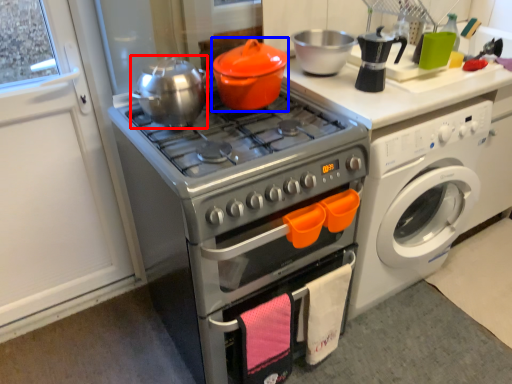
Question: Which object is closer to the camera taking this photo, tea pot (highlighted by a red box) or crock pot (highlighted by a blue box)?

Choices:
 (A) tea pot
 (B) crock pot

Answer: (A)